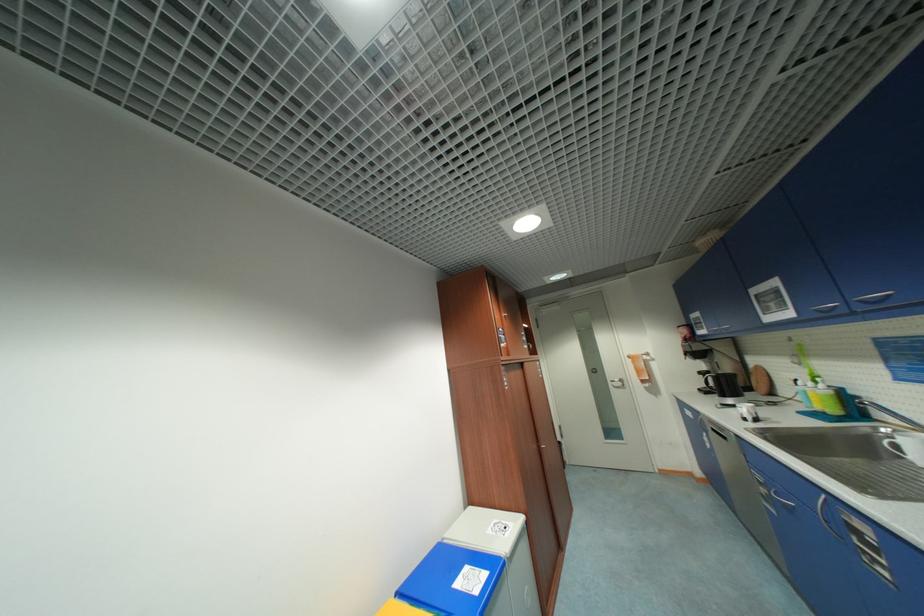
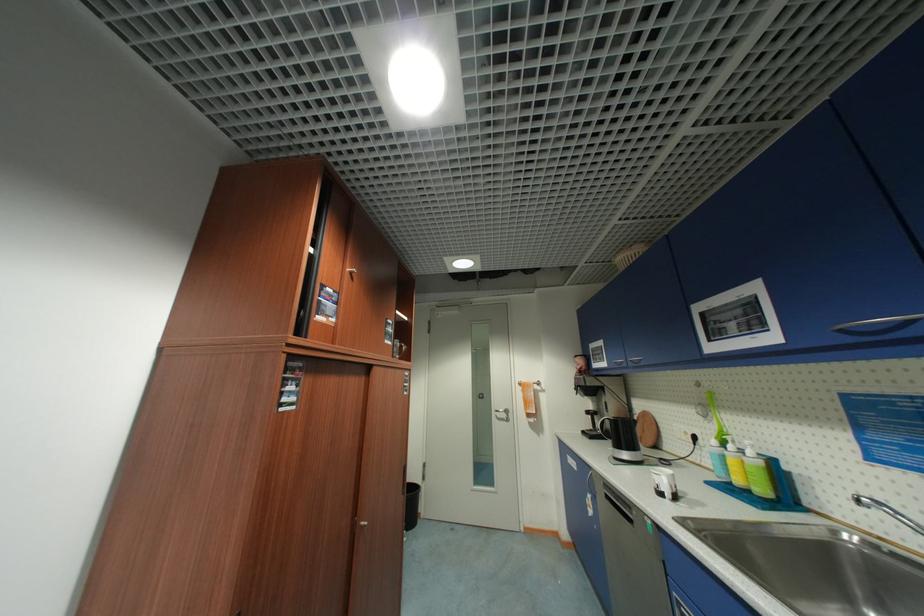
Which direction would the cameraman need to move to produce the second image?

The cameraman moved toward right, forward.